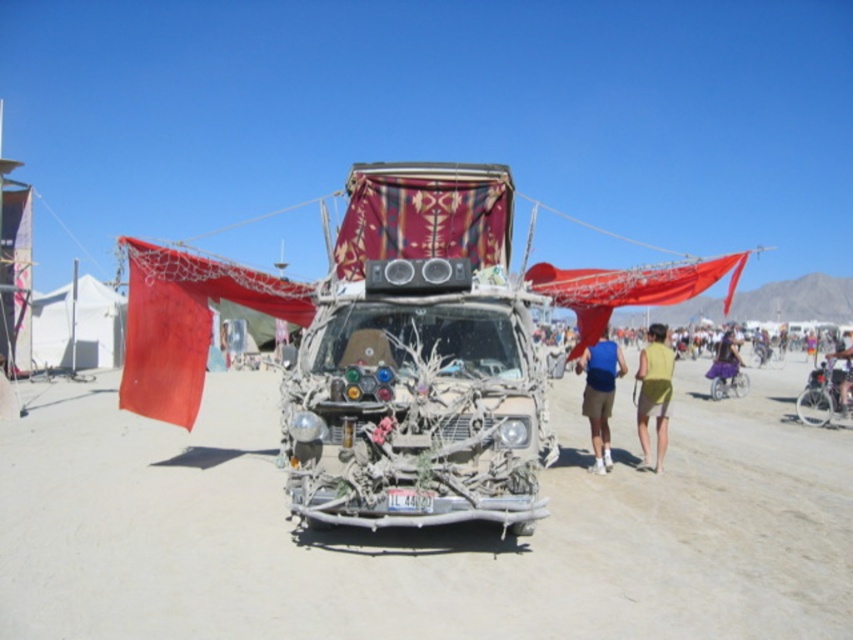
Is blue fabric shorts at center above metallic silver bicycle at center-right?

Yes.

Who is lower down, blue fabric shorts at center or metallic silver bicycle at center-right?

Positioned lower is metallic silver bicycle at center-right.

Where is `blue fabric shorts at center`? Image resolution: width=853 pixels, height=640 pixels. blue fabric shorts at center is located at coordinates (601, 394).

Who is lower down, decorative wood van at center or metallic silver bicycle at center-right?

metallic silver bicycle at center-right

Can you confirm if decorative wood van at center is taller than metallic silver bicycle at center-right?

Correct, decorative wood van at center is much taller as metallic silver bicycle at center-right.

Who is more forward, (302, 378) or (717, 364)?

Point (302, 378)

The width and height of the screenshot is (853, 640). I want to click on decorative wood van at center, so click(416, 410).

Does decorative wood van at center have a lesser width compared to purple fabric skirt at right?

Yes, decorative wood van at center is thinner than purple fabric skirt at right.

You are a GUI agent. You are given a task and a screenshot of the screen. Output one action in this format:
    pyautogui.click(x=<x>, y=<y>)
    Task: Click on the decorative wood van at center
    
    Given the screenshot: What is the action you would take?
    pos(416,410)

Does point (427, 337) come farther from viewer compared to point (722, 371)?

No, it is in front of (722, 371).

Find the location of a particular element. decorative wood van at center is located at coordinates (416, 410).